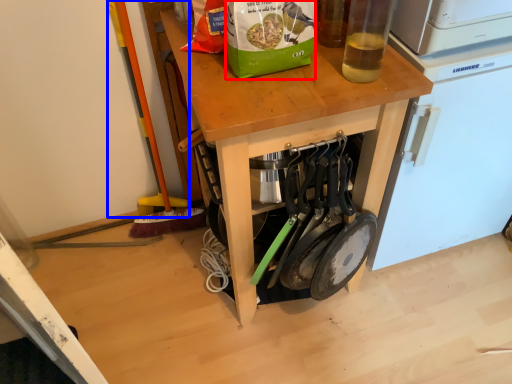
Question: Which point is further to the camera, paper bag (highlighted by a red box) or brush (highlighted by a blue box)?

Choices:
 (A) paper bag
 (B) brush

Answer: (B)